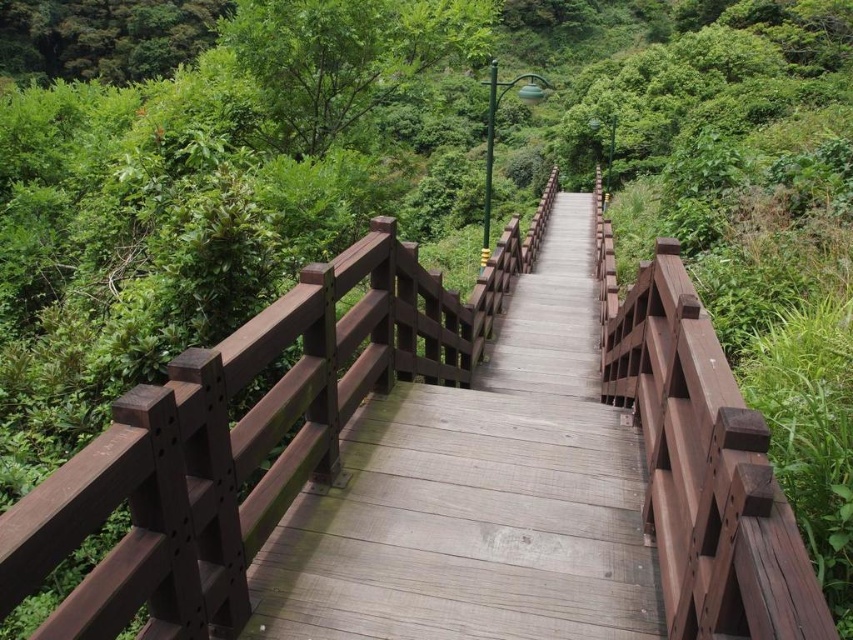
Does green leafy tree at upper center have a lesser width compared to green leafy tree at upper left?

Indeed, green leafy tree at upper center has a lesser width compared to green leafy tree at upper left.

Between green leafy tree at upper center and green leafy tree at upper left, which one appears on the right side from the viewer's perspective?

green leafy tree at upper center

Which is in front, point (352, 45) or point (61, 60)?

Positioned in front is point (352, 45).

Image resolution: width=853 pixels, height=640 pixels. I want to click on green leafy tree at upper center, so click(345, 58).

Does wooden bridge at center have a lesser width compared to green leafy tree at upper left?

Correct, wooden bridge at center's width is less than green leafy tree at upper left's.

Who is more distant from viewer, (550, 524) or (131, 77)?

The point (131, 77) is more distant.

Is point (398, 420) behind point (49, 19)?

No, it is in front of (49, 19).

Image resolution: width=853 pixels, height=640 pixels. I want to click on wooden bridge at center, so point(479,488).

Is wooden bridge at center closer to the viewer compared to green leafy tree at upper center?

Yes, it is in front of green leafy tree at upper center.

Is point (366, 426) positioned after point (372, 56)?

No, (366, 426) is closer to viewer.

What are the coordinates of `wooden bridge at center` in the screenshot? It's located at (479, 488).